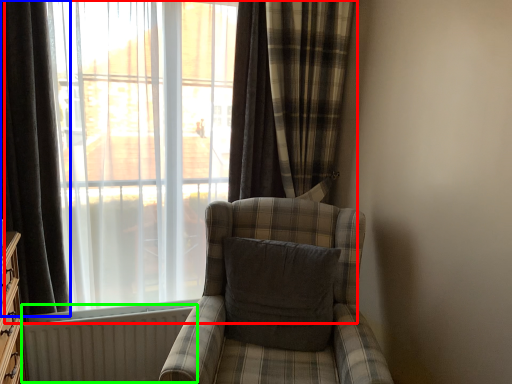
Question: Considering the real-world distances, which object is closest to window (highlighted by a red box)? curtain (highlighted by a blue box) or radiator (highlighted by a green box).

Choices:
 (A) curtain
 (B) radiator

Answer: (A)